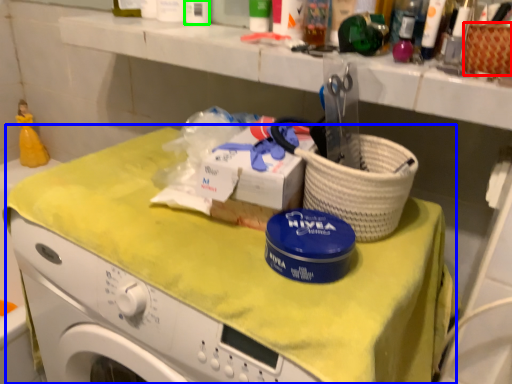
Question: Which object is positioned farthest from basket (highlighted by a red box)? Select from counter (highlighted by a blue box) and toiletry (highlighted by a green box).

Choices:
 (A) counter
 (B) toiletry

Answer: (B)